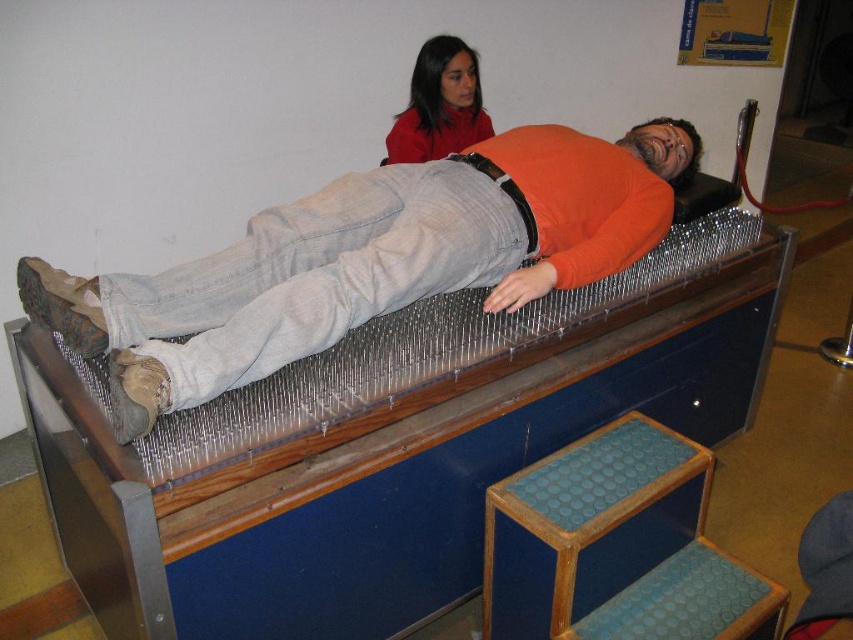
Is the position of wooden bed frame at center less distant than that of orange matte shirt at center?

Yes, it is in front of orange matte shirt at center.

Does wooden bed frame at center have a lesser width compared to orange matte shirt at center?

Incorrect, wooden bed frame at center's width is not less than orange matte shirt at center's.

What do you see at coordinates (386, 444) in the screenshot? I see `wooden bed frame at center` at bounding box center [386, 444].

This screenshot has width=853, height=640. In order to click on wooden bed frame at center in this screenshot , I will do `click(386, 444)`.

Consider the image. Is wooden bed frame at center bigger than blue rubberized step at lower right?

Yes, wooden bed frame at center is bigger than blue rubberized step at lower right.

Is point (688, 337) positioned in front of point (556, 474)?

That is False.

You are a GUI agent. You are given a task and a screenshot of the screen. Output one action in this format:
    pyautogui.click(x=<x>, y=<y>)
    Task: Click on the wooden bed frame at center
    
    Given the screenshot: What is the action you would take?
    (x=386, y=444)

From the picture: Which is above, blue rubberized step at lower right or matte red sweater at upper center?

matte red sweater at upper center

Can you confirm if blue rubberized step at lower right is positioned above matte red sweater at upper center?

Actually, blue rubberized step at lower right is below matte red sweater at upper center.

Is point (577, 618) behind point (445, 58)?

No, it is not.

This screenshot has height=640, width=853. In order to click on blue rubberized step at lower right in this screenshot , I will do `click(616, 547)`.